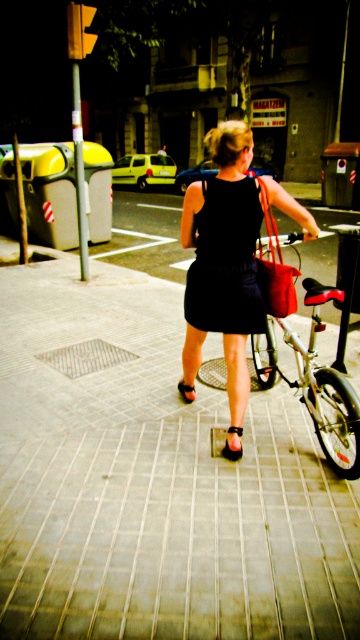
Question: Is matte black dress at center bigger than black matte dress at center?

Choices:
 (A) no
 (B) yes

Answer: (B)

Question: Can you confirm if matte black dress at center is smaller than black matte dress at center?

Choices:
 (A) no
 (B) yes

Answer: (A)

Question: Which object is closer to the camera taking this photo?

Choices:
 (A) silver metallic bicycle at center
 (B) black matte dress at center
 (C) brown leather sandal at center
 (D) black leather sandal at center

Answer: (A)

Question: Among these points, which one is nearest to the camera?

Choices:
 (A) (226, 330)
 (B) (119, 314)
 (C) (191, 387)

Answer: (A)

Question: Is black matte dress at center wider than black leather sandal at center?

Choices:
 (A) yes
 (B) no

Answer: (A)

Question: Among these points, which one is nearest to the camera?

Choices:
 (A) (205, 323)
 (B) (200, 262)
 (C) (181, 392)

Answer: (B)